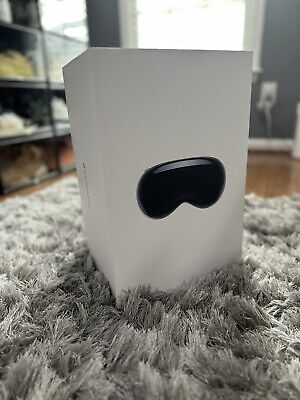
The width and height of the screenshot is (300, 400). In order to click on fringes of rug around box in this screenshot , I will do `click(144, 289)`, `click(130, 296)`, `click(109, 295)`, `click(97, 276)`, `click(89, 262)`, `click(204, 280)`, `click(227, 273)`, `click(236, 268)`.